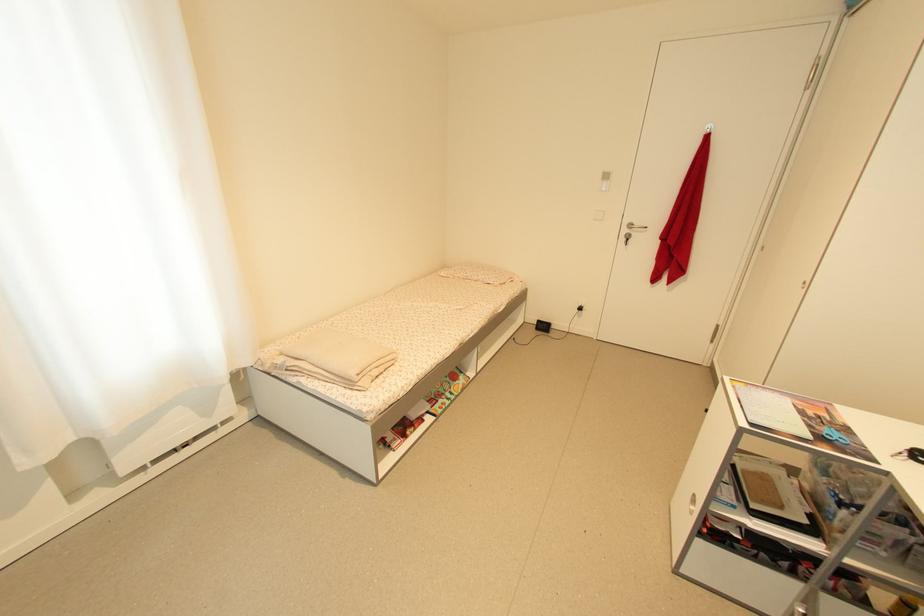
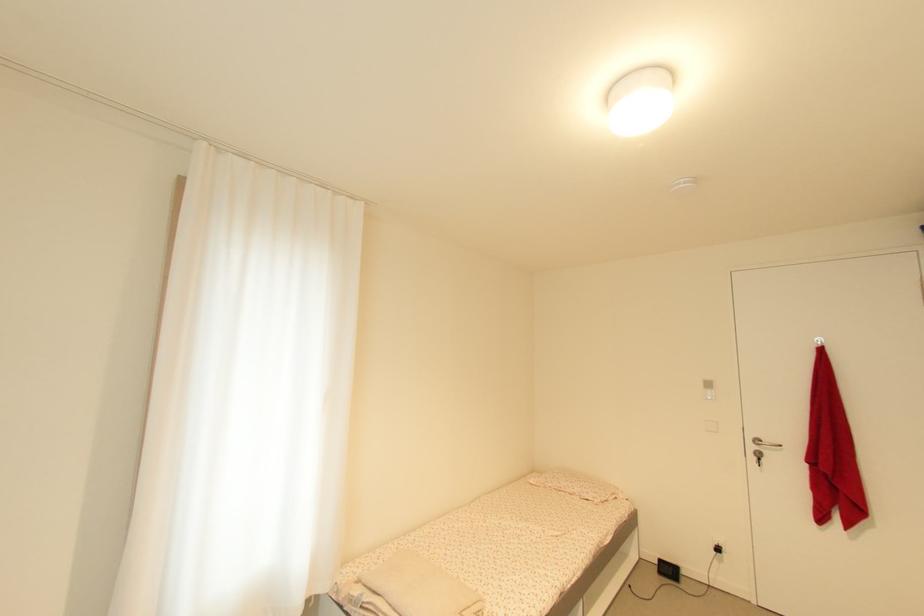
First-person continuous shooting, in which direction is the camera rotating?

The camera rotated toward left-up.